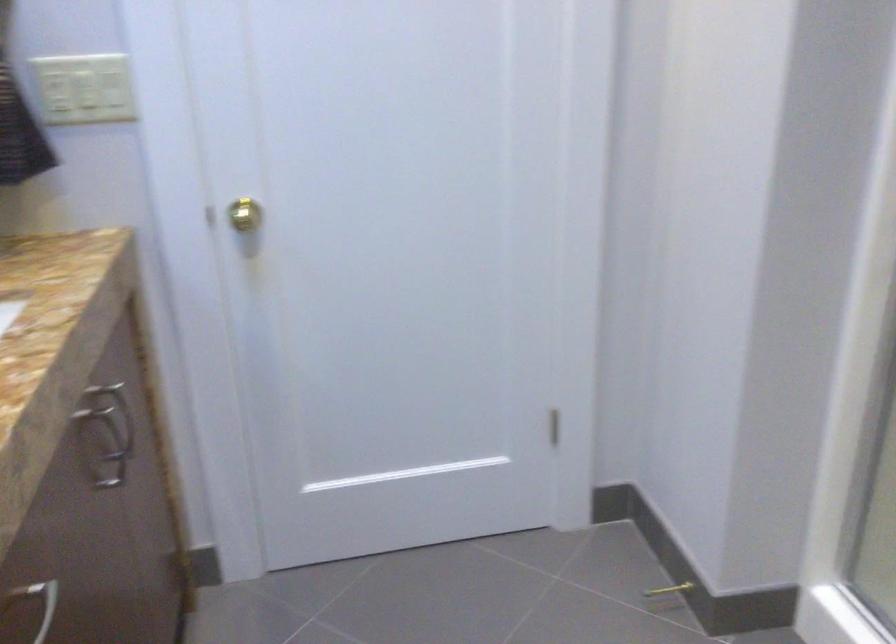
What do you see at coordinates (240, 214) in the screenshot?
I see `a brass door knob` at bounding box center [240, 214].